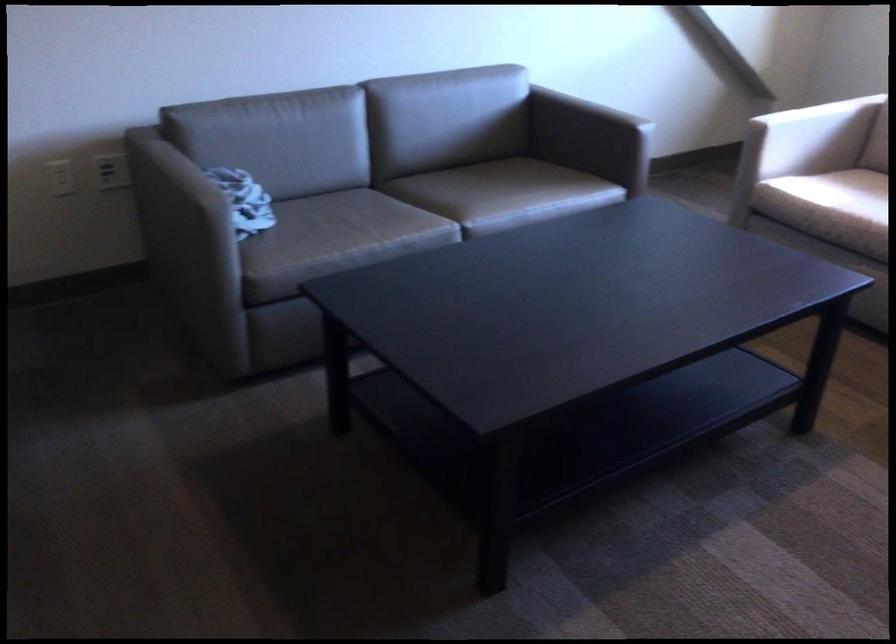
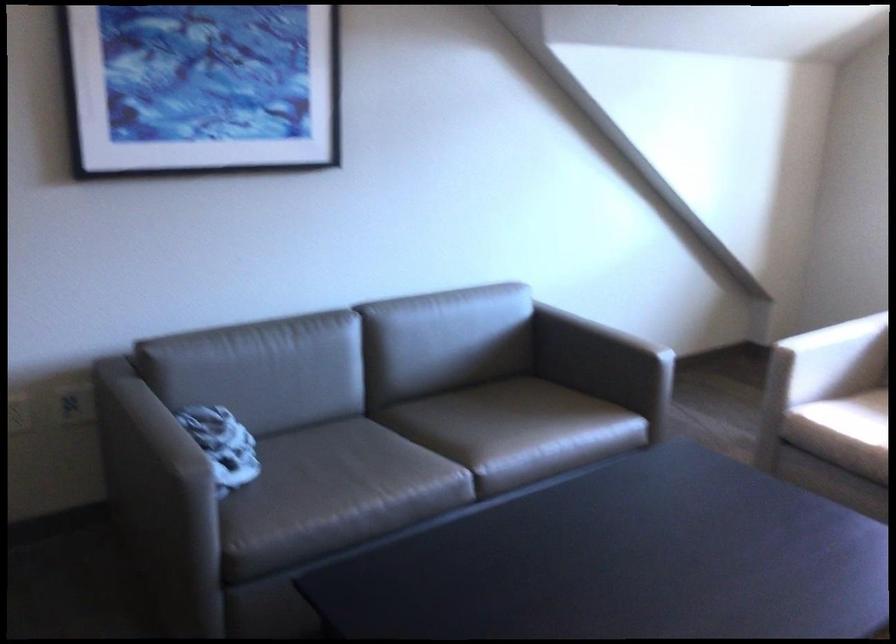
Where in the second image is the point corresponding to point 485,192 from the first image?

(497, 430)